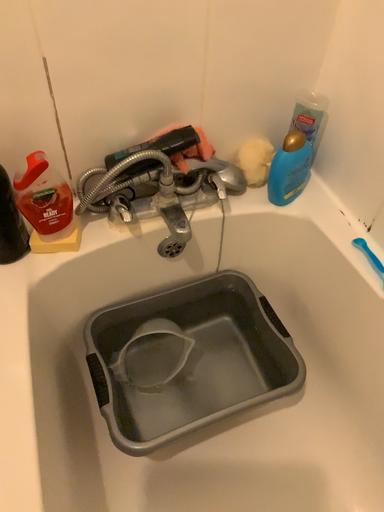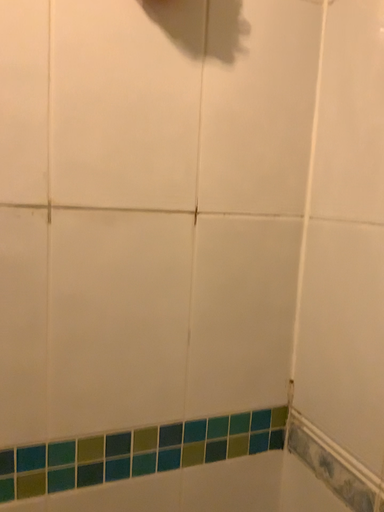
Question: Which way did the camera rotate in the video?

Choices:
 (A) rotated downward
 (B) rotated upward

Answer: (B)